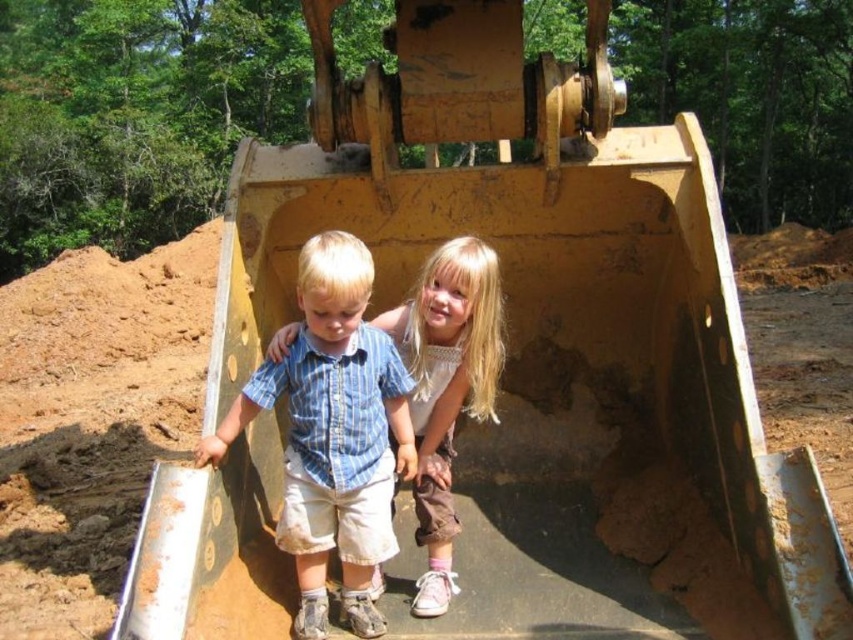
Is point (315, 628) farther from viewer compared to point (426, 605)?

No, it is not.

The image size is (853, 640). I want to click on blue striped shirt at center, so (334, 435).

Is point (311, 563) behind point (450, 438)?

No, it is in front of (450, 438).

Locate an element on the screen. Image resolution: width=853 pixels, height=640 pixels. blue striped shirt at center is located at coordinates (334, 435).